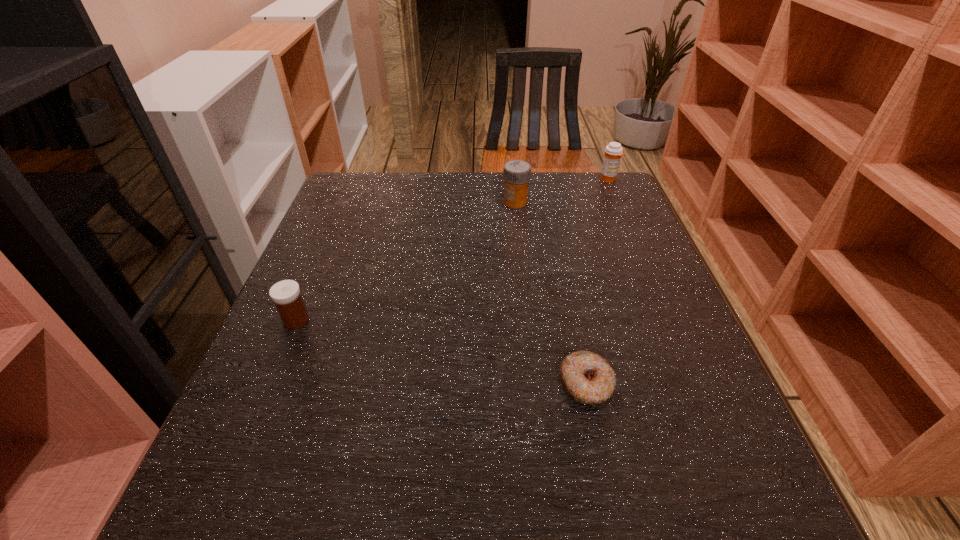
Locate an element on the screen. The width and height of the screenshot is (960, 540). free space between the second nearest medicine and the rightmost medicine is located at coordinates (562, 191).

What are the coordinates of `vacant area that lies between the rightmost medicine and the second object from right to left` in the screenshot? It's located at (597, 282).

You are a GUI agent. You are given a task and a screenshot of the screen. Output one action in this format:
    pyautogui.click(x=<x>, y=<y>)
    Task: Click on the free space that is in between the nearest medicine and the second nearest medicine
    This screenshot has width=960, height=540.
    Given the screenshot: What is the action you would take?
    pyautogui.click(x=406, y=261)

Find the location of `object that is the third nearest to the shortest medicine`. object that is the third nearest to the shortest medicine is located at coordinates (613, 152).

Where is `object that is the second nearest to the rightmost medicine`? This screenshot has height=540, width=960. object that is the second nearest to the rightmost medicine is located at coordinates pyautogui.click(x=587, y=377).

At what (x,y) coordinates should I click in order to perform the action: click on the closest medicine to the rightmost medicine. Please return your answer as a coordinate pair (x, y). Looking at the image, I should click on (517, 173).

In order to click on the closest medicine relative to the third nearest object in this screenshot , I will do `click(613, 152)`.

You are a GUI agent. You are given a task and a screenshot of the screen. Output one action in this format:
    pyautogui.click(x=<x>, y=<y>)
    Task: Click on the free space that satisfies the following two spatial constraints: 1. on the label side of the second medicine from left to right; 2. on the front side of the nearest medicine
    This screenshot has width=960, height=540.
    Given the screenshot: What is the action you would take?
    pyautogui.click(x=528, y=320)

Find the location of `vacant area in the image that satisfies the following two spatial constraints: 1. on the label side of the second medicine from right to left; 2. on the back side of the shortest object`. vacant area in the image that satisfies the following two spatial constraints: 1. on the label side of the second medicine from right to left; 2. on the back side of the shortest object is located at coordinates (535, 384).

This screenshot has height=540, width=960. What are the coordinates of `vacant region that satisfies the following two spatial constraints: 1. on the front side of the rightmost object; 2. on the label side of the third object from right to left` in the screenshot? It's located at (618, 202).